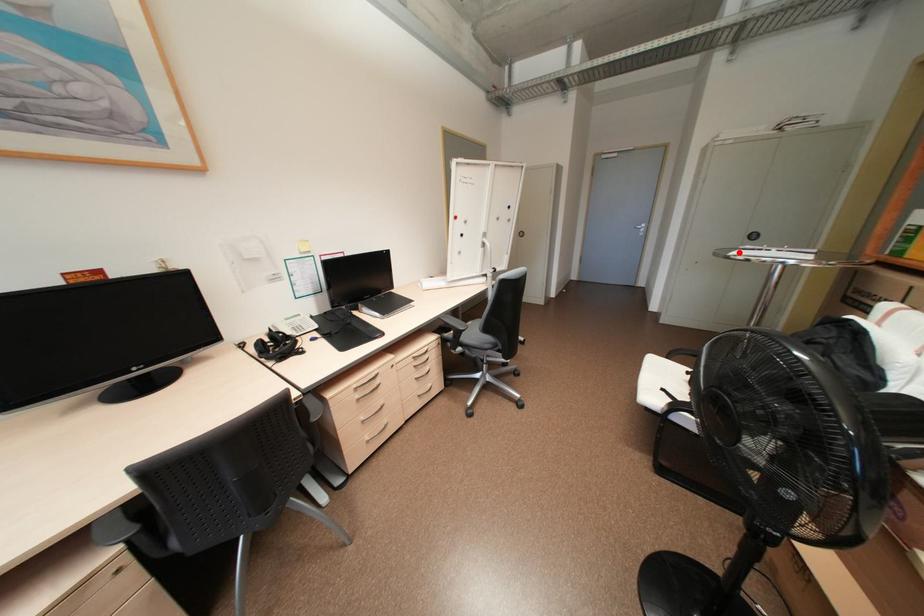
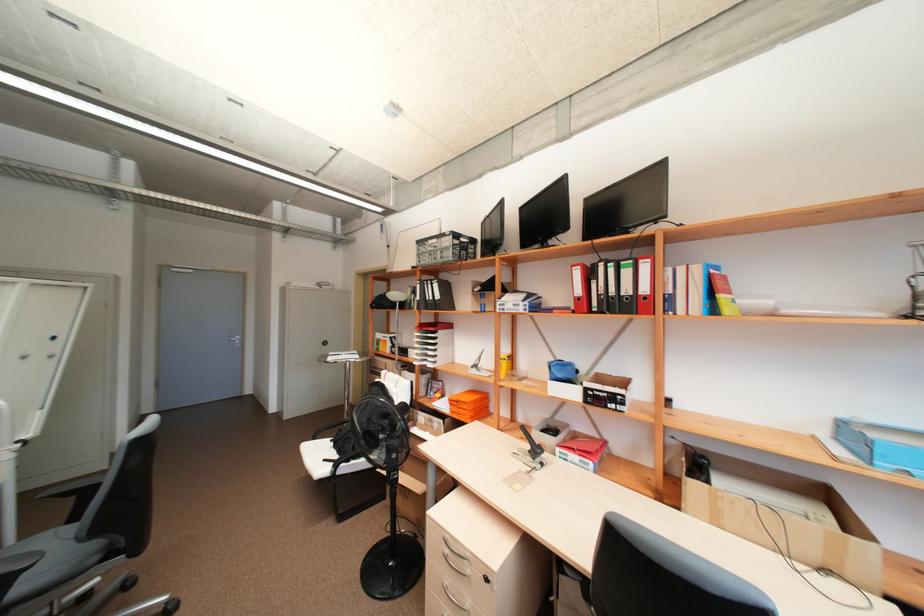
Where in the second image is the point corresponding to the highlighted location from the first image?

(334, 359)